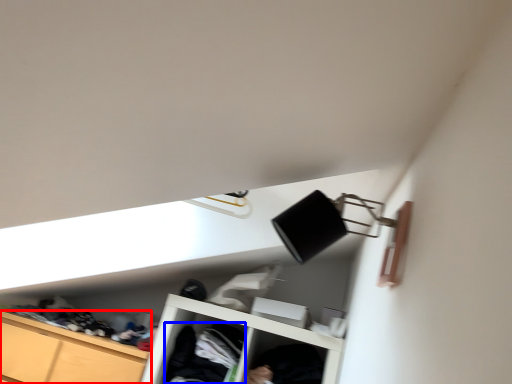
Question: Which of the following is the closest to the observer, cabinetry (highlighted by a red box) or clothing (highlighted by a blue box)?

Choices:
 (A) cabinetry
 (B) clothing

Answer: (A)